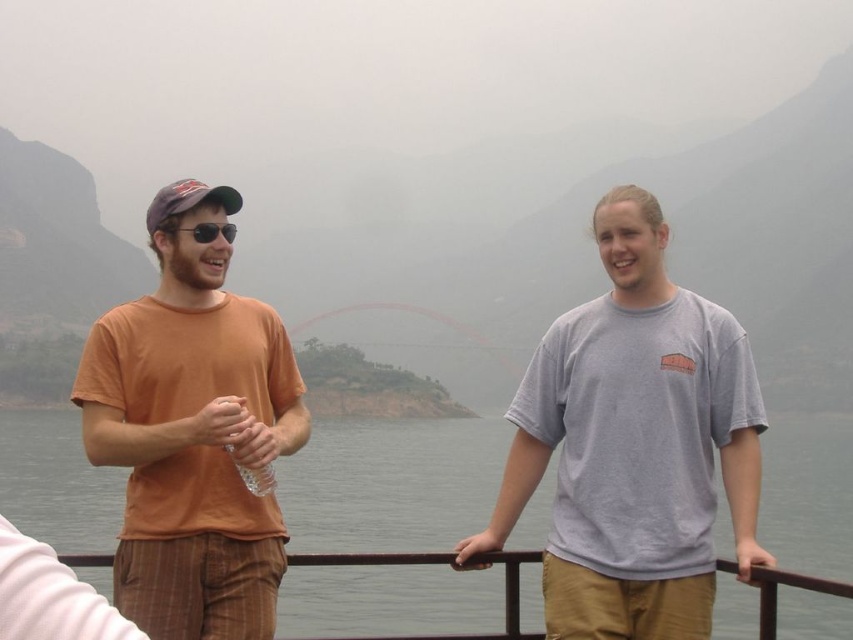
Question: Which point appears closest to the camera in this image?

Choices:
 (A) (195, 234)
 (B) (91, 561)
 (C) (711, 326)
 (D) (212, 332)

Answer: (B)

Question: Considering the real-world distances, which object is farthest from the transparent water at center?

Choices:
 (A) metallic brown railing at center
 (B) orange cotton t-shirt at left
 (C) black plastic sunglasses at center

Answer: (C)

Question: Is transparent water at center to the left of gray cotton t-shirt at center from the viewer's perspective?

Choices:
 (A) no
 (B) yes

Answer: (B)

Question: Which object is farther from the camera taking this photo?

Choices:
 (A) black plastic sunglasses at center
 (B) metallic brown railing at center
 (C) orange cotton t-shirt at left
 (D) gray cotton t-shirt at center

Answer: (A)

Question: Can you confirm if transparent water at center is positioned to the right of metallic brown railing at center?

Choices:
 (A) no
 (B) yes

Answer: (A)

Question: Can you confirm if transparent water at center is bigger than metallic brown railing at center?

Choices:
 (A) no
 (B) yes

Answer: (B)